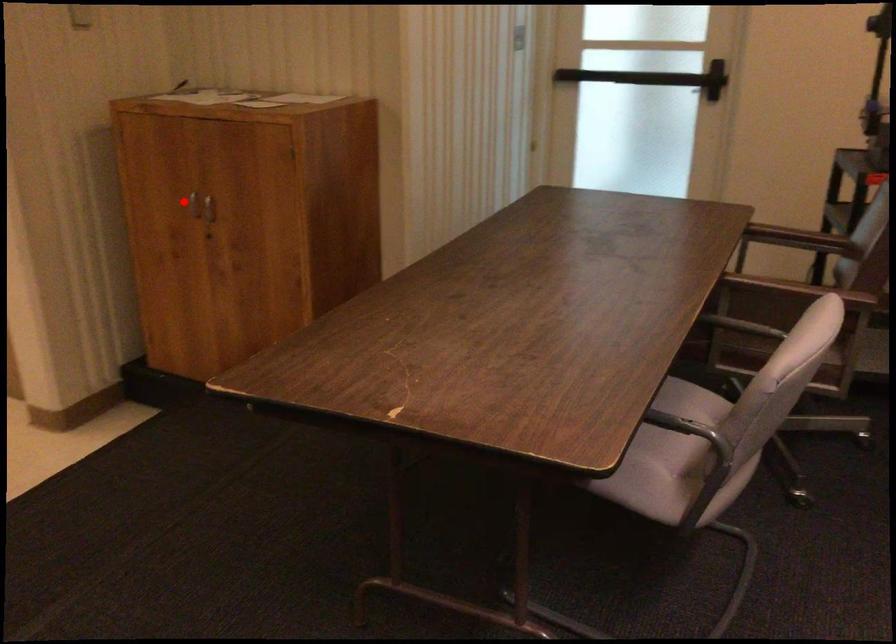
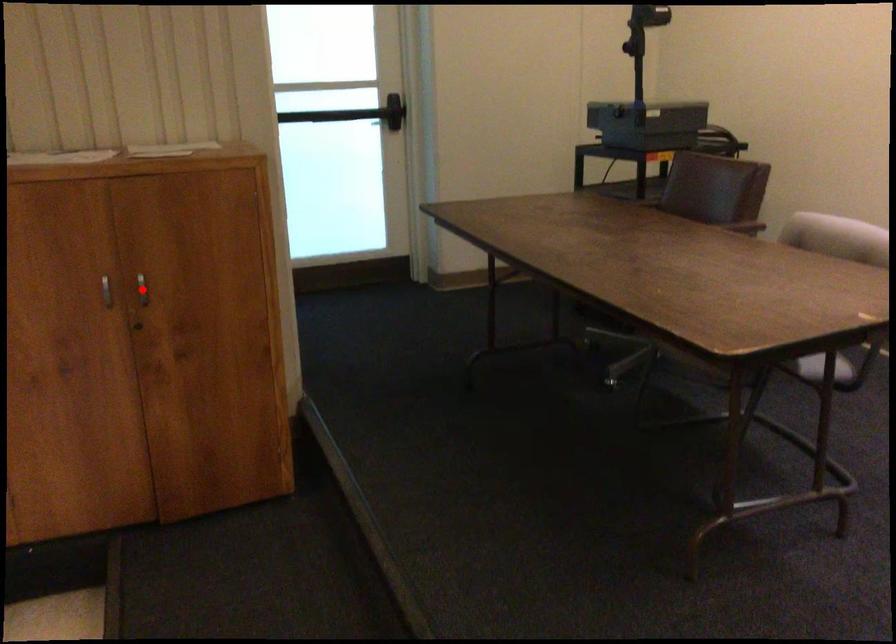
I am providing you with two images of the same scene from different viewpoints. A red point is marked on the first image and another point is marked on the second image. Is the marked point in image1 the same physical position as the marked point in image2?

No